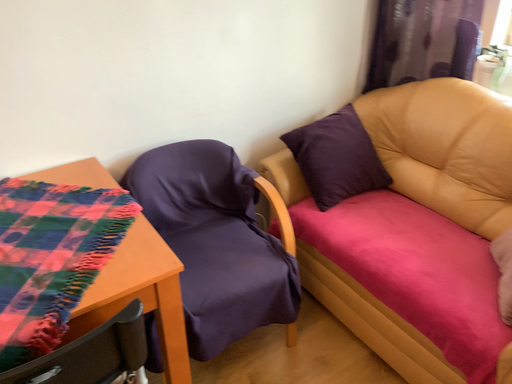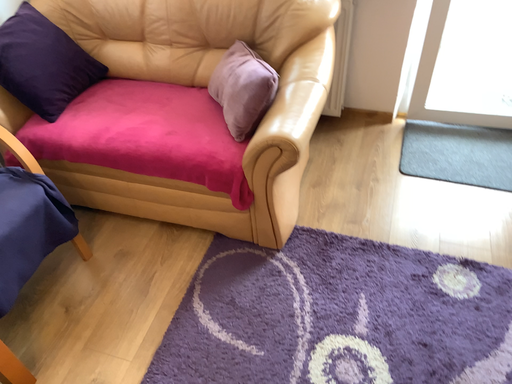
Question: Which way did the camera rotate in the video?

Choices:
 (A) rotated left
 (B) rotated right

Answer: (B)